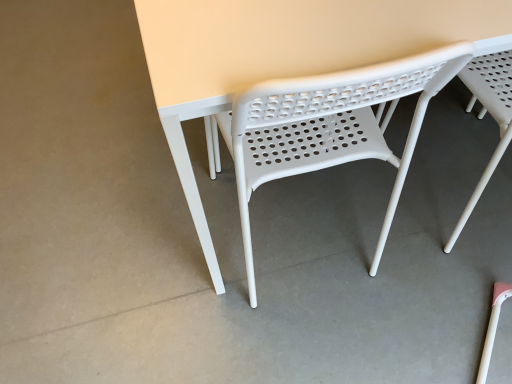
Where is `vacant space in white plastic chair at center (from a real-world perspective)`? This screenshot has width=512, height=384. vacant space in white plastic chair at center (from a real-world perspective) is located at coordinates (296, 224).